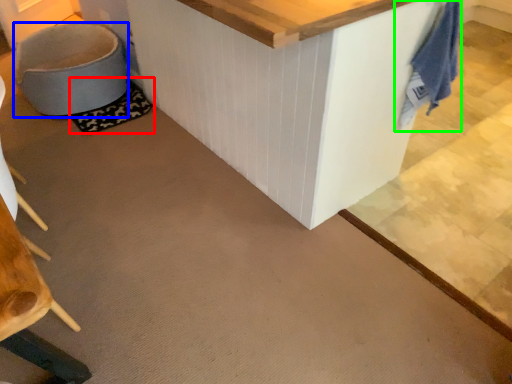
Question: Which object is the farthest from mat (highlighted by a red box)? Choose among these: swivel chair (highlighted by a blue box) or laundry (highlighted by a green box).

Choices:
 (A) swivel chair
 (B) laundry

Answer: (B)